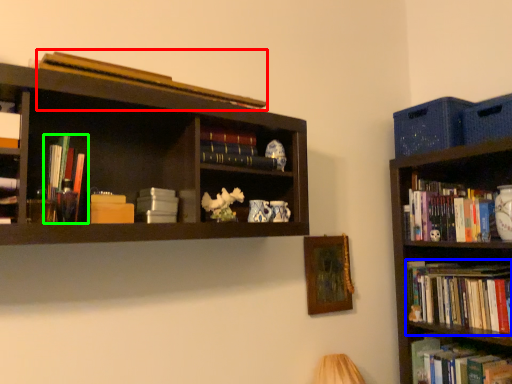
Question: Which object is positioned farthest from book (highlighted by a red box)? Select from book (highlighted by a blue box) and book (highlighted by a green box).

Choices:
 (A) book
 (B) book

Answer: (A)